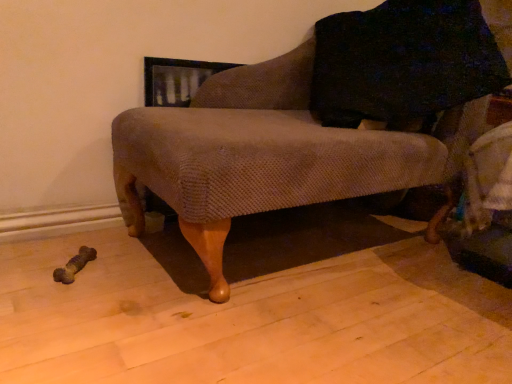
Where is `knitted fabric chair at center`? knitted fabric chair at center is located at coordinates (269, 154).

This screenshot has height=384, width=512. Describe the element at coordinates (269, 154) in the screenshot. I see `knitted fabric chair at center` at that location.

Find the location of a particular element. The height and width of the screenshot is (384, 512). knitted fabric chair at center is located at coordinates (269, 154).